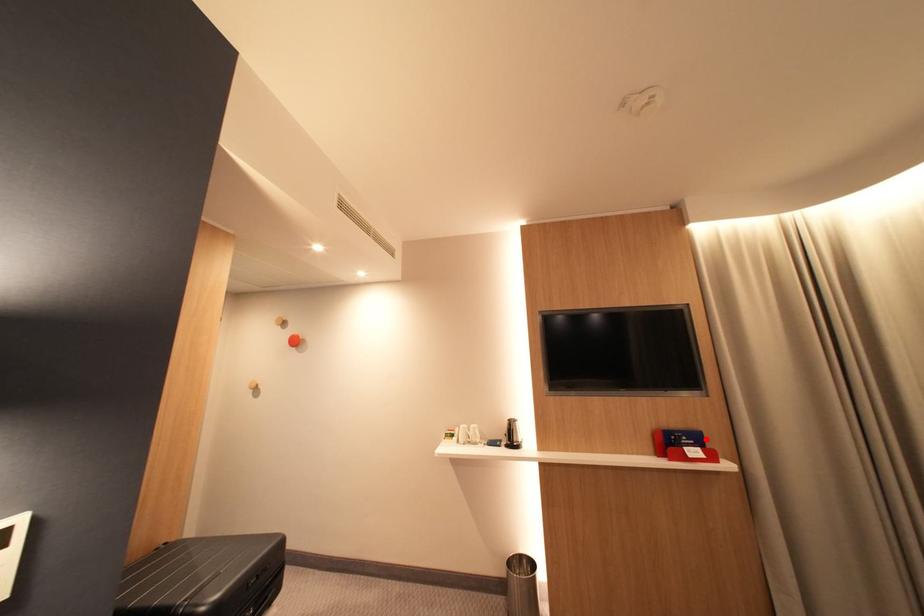
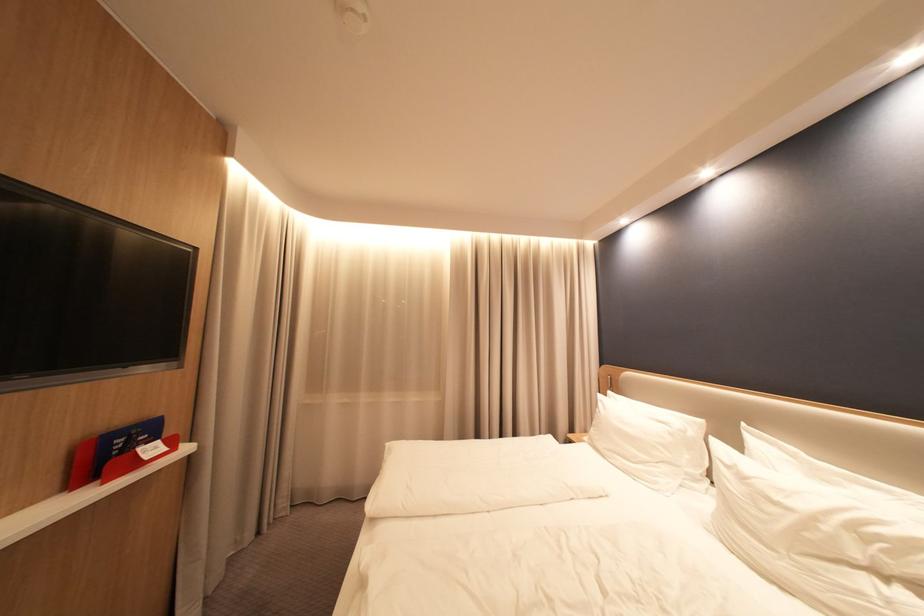
Find the pixel in the second image that matches the highlighted location in the first image.

(160, 431)